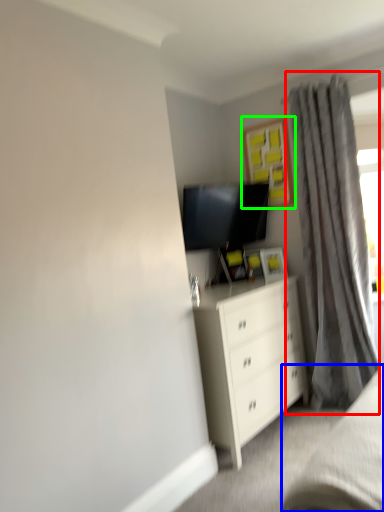
Question: Considering the real-world distances, which object is farthest from curtain (highlighted by a red box)? bed frame (highlighted by a blue box) or picture frame (highlighted by a green box)?

Choices:
 (A) bed frame
 (B) picture frame

Answer: (A)